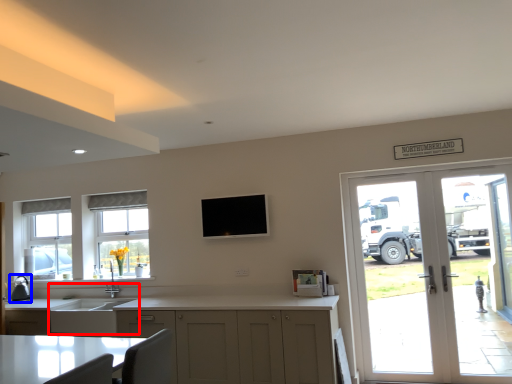
Question: Which of the following is the farthest to the observer, sink (highlighted by a red box) or appliance (highlighted by a blue box)?

Choices:
 (A) sink
 (B) appliance

Answer: (B)